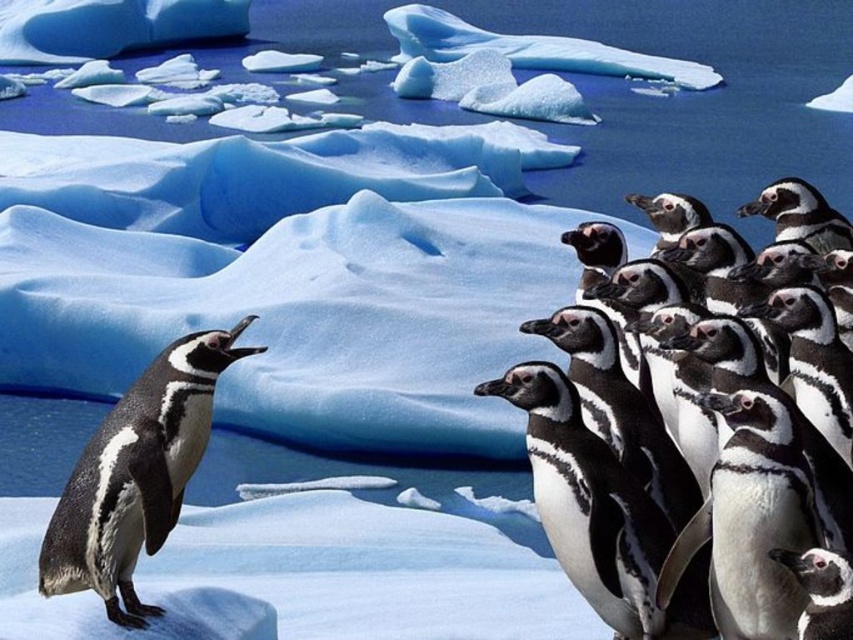
Who is taller, black glossy penguin at center or translucent ice at upper center?

black glossy penguin at center is taller.

Who is positioned more to the right, black glossy penguin at center or translucent ice at upper center?

Positioned to the right is translucent ice at upper center.

The height and width of the screenshot is (640, 853). In order to click on black glossy penguin at center in this screenshot , I will do `click(599, 513)`.

Which is above, black glossy penguin at left or black matte penguin at lower right?

black glossy penguin at left is above.

Which is more to the right, black glossy penguin at left or black matte penguin at lower right?

From the viewer's perspective, black matte penguin at lower right appears more on the right side.

Is point (132, 486) positioned in front of point (828, 561)?

No, (132, 486) is further to viewer.

The width and height of the screenshot is (853, 640). In order to click on black glossy penguin at left in this screenshot , I will do `click(136, 476)`.

Where is `black glossy penguin at left`? black glossy penguin at left is located at coordinates (136, 476).

Who is shorter, black glossy penguin at left or black glossy penguin at center?

black glossy penguin at center is shorter.

Which is behind, point (169, 522) or point (569, 529)?

The point (569, 529) is behind.

Find the location of `black glossy penguin at left`. black glossy penguin at left is located at coordinates (136, 476).